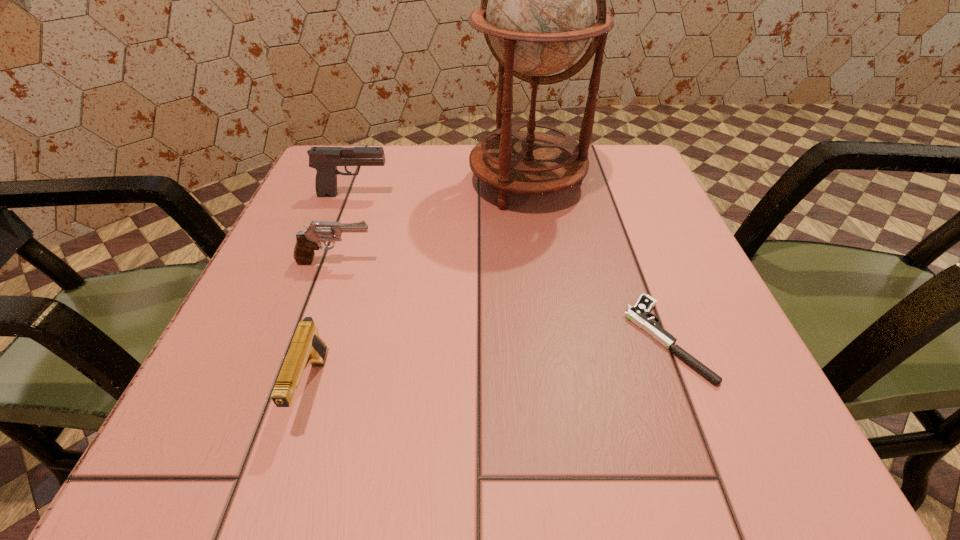
Locate an element on the screen. This screenshot has height=540, width=960. vacant space located 0.290m on the front-facing side of the shortest pistol is located at coordinates (429, 339).

The height and width of the screenshot is (540, 960). I want to click on free location located 0.050m on the front-facing side of the shortest pistol, so click(x=596, y=339).

At what (x,y) coordinates should I click in order to perform the action: click on globe located at the far edge. Please return your answer as a coordinate pair (x, y). Looking at the image, I should click on (538, 8).

At what (x,y) coordinates should I click in order to perform the action: click on pistol situated at the far edge. Please return your answer as a coordinate pair (x, y). This screenshot has width=960, height=540. Looking at the image, I should click on (325, 160).

The height and width of the screenshot is (540, 960). Identify the location of object present at the near edge. (307, 347).

Where is `globe that is positioned at the right edge`? This screenshot has height=540, width=960. globe that is positioned at the right edge is located at coordinates (538, 8).

The width and height of the screenshot is (960, 540). In order to click on pistol located in the right edge section of the desktop in this screenshot , I will do `click(639, 314)`.

Find the location of a particular element. object present at the far left corner is located at coordinates (325, 160).

In order to click on object present at the near left corner in this screenshot , I will do (307, 347).

The width and height of the screenshot is (960, 540). Find the location of `object that is at the far right corner`. object that is at the far right corner is located at coordinates (538, 8).